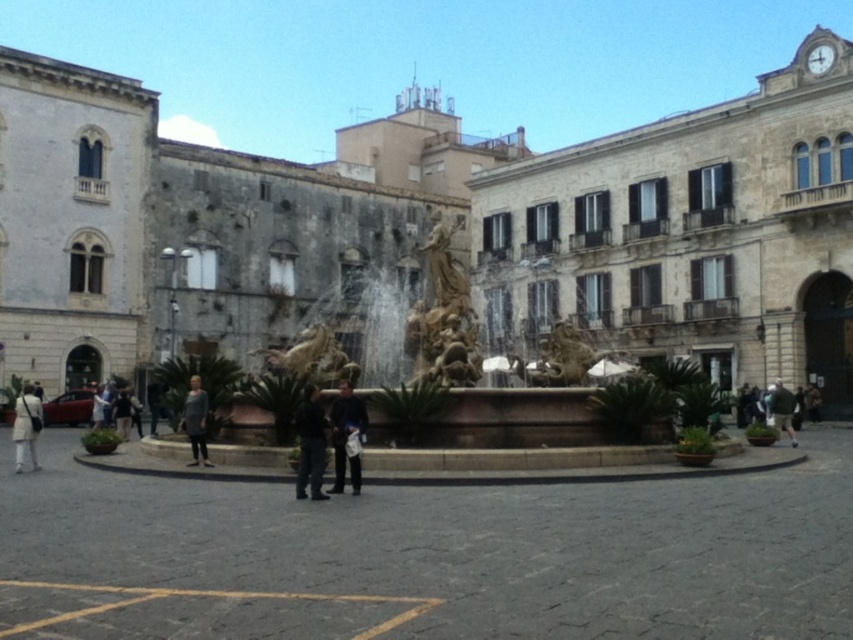
You are a fashion designer observing people in the urban square. You notice two items of clothing on a person at the center of the square. Which item has a larger size between the dark gray fabric pants at center and the gray fabric jacket at center?

The dark gray fabric pants at center is bigger than the gray fabric jacket at center.

You are standing in the urban square and want to take a photo of both the golden stone fountain at center and the gray fabric jacket at center. To ensure both are in focus, should you focus on the closer object or the farther one?

Since the golden stone fountain at center is closer to the viewer than the gray fabric jacket at center, you should focus on the closer object to ensure both are in focus.

You are a fashion designer observing two garments in an urban square scene. You notice the dark gray fabric pants at center and the gray fabric jacket at center. Which garment appears taller when viewed from the front?

The dark gray fabric pants at center appears taller than the gray fabric jacket at center because it has a greater height compared to the jacket.